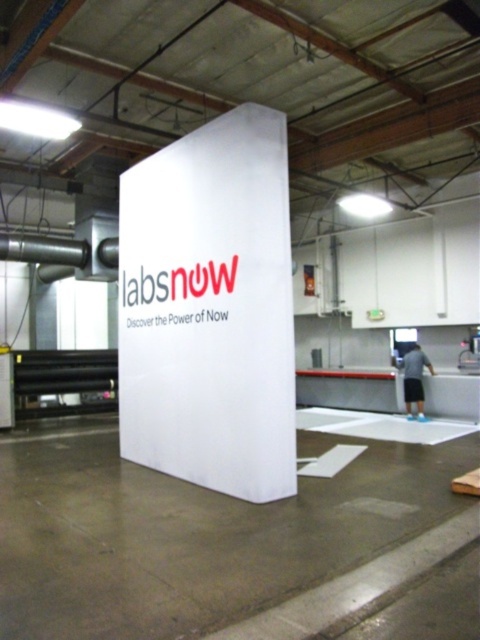
Question: Can you confirm if white matte sign at center is wider than blue denim shorts at lower right?

Choices:
 (A) no
 (B) yes

Answer: (B)

Question: Observing the image, what is the correct spatial positioning of white matte sign at center in reference to blue denim shorts at lower right?

Choices:
 (A) left
 (B) right

Answer: (A)

Question: Among these objects, which one is farthest from the camera?

Choices:
 (A) blue denim shorts at lower right
 (B) white matte sign at center

Answer: (A)

Question: Which point is farther to the camera?

Choices:
 (A) (419, 417)
 (B) (143, 390)

Answer: (A)

Question: Can you confirm if white matte sign at center is bigger than blue denim shorts at lower right?

Choices:
 (A) yes
 (B) no

Answer: (A)